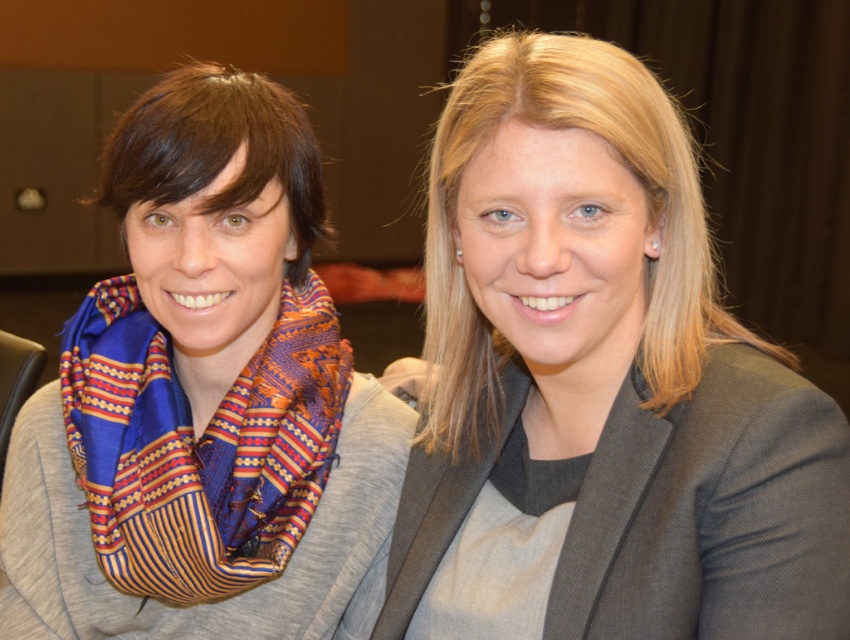
You are a photographer adjusting the framing of a portrait. You need to ensure that both the smooth gray blazer at center and the silky blue and orange scarf at left are fully visible in the frame. Given their sizes, which object should you prioritize keeping centered to avoid cropping?

The smooth gray blazer at center has a larger width than the silky blue and orange scarf at left. To avoid cropping, prioritize keeping the smooth gray blazer at center centered in the frame since it requires more space.

You are a photographer adjusting the camera focus. You need to ensure both the smooth gray blazer at center and the matte blue scarf at left are in focus. Given their heights, which object should you focus on first to achieve proper depth of field?

The smooth gray blazer at center has a lesser height compared to the matte blue scarf at left. To achieve proper depth of field, focus on the taller object first, so you should focus on the matte blue scarf at left first.

You are a photographer adjusting the focus on a camera. You need to ensure both the smooth gray blazer at center and the matte blue scarf at left are in focus. Which object should you adjust the focus towards first to capture both in sharp detail?

The smooth gray blazer at center is larger in size compared to the matte blue scarf at left, so you should focus on the smooth gray blazer at center first to ensure both are in sharp detail.